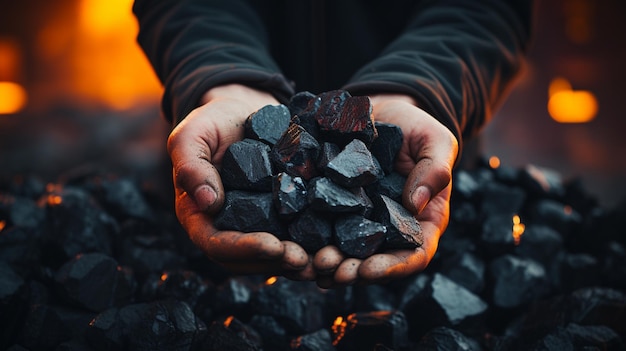
Locate an element on the screen. chest is located at coordinates click(335, 17).